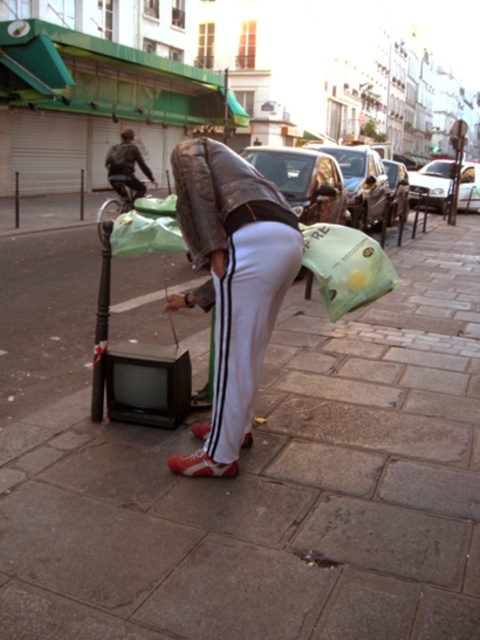
Question: Does gray concrete pavement at center have a lesser width compared to leather jacket at center?

Choices:
 (A) no
 (B) yes

Answer: (B)

Question: Where is gray concrete pavement at center located in relation to leather jacket at center in the image?

Choices:
 (A) right
 (B) left

Answer: (B)

Question: Among these points, which one is farthest from the camera?

Choices:
 (A) (240, 161)
 (B) (372, 516)

Answer: (A)

Question: Which point is closer to the camera?

Choices:
 (A) (120, 506)
 (B) (262, 326)

Answer: (A)

Question: Considering the relative positions of gray concrete pavement at center and leather jacket at center in the image provided, where is gray concrete pavement at center located with respect to leather jacket at center?

Choices:
 (A) left
 (B) right

Answer: (A)

Question: Among these objects, which one is nearest to the camera?

Choices:
 (A) gray concrete pavement at center
 (B) leather jacket at center

Answer: (A)